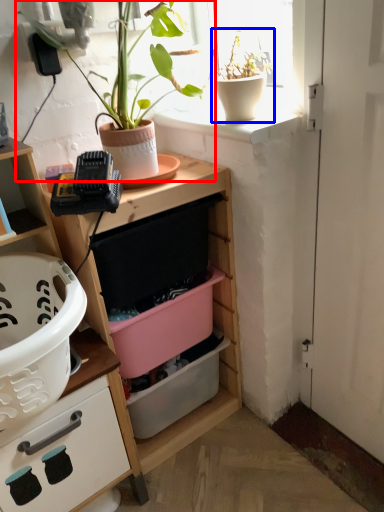
Question: Among these objects, which one is farthest to the camera, houseplant (highlighted by a red box) or houseplant (highlighted by a blue box)?

Choices:
 (A) houseplant
 (B) houseplant

Answer: (B)